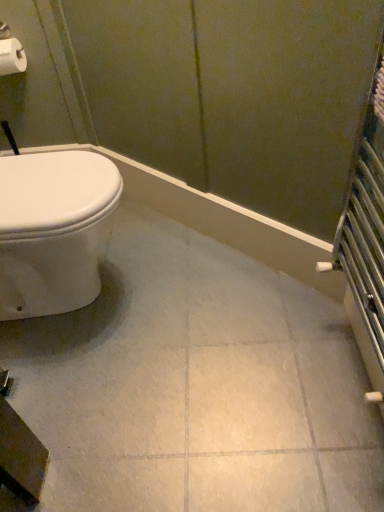
Question: Is white glossy ceramic tile at center shorter than white matte toilet paper at upper left?

Choices:
 (A) yes
 (B) no

Answer: (A)

Question: Can you confirm if white glossy ceramic tile at center is smaller than white matte toilet paper at upper left?

Choices:
 (A) no
 (B) yes

Answer: (A)

Question: From the image's perspective, would you say white glossy ceramic tile at center is positioned over white matte toilet paper at upper left?

Choices:
 (A) yes
 (B) no

Answer: (B)

Question: Is white glossy ceramic tile at center looking in the opposite direction of white matte toilet paper at upper left?

Choices:
 (A) yes
 (B) no

Answer: (B)

Question: Is white glossy ceramic tile at center at the right side of white matte toilet paper at upper left?

Choices:
 (A) yes
 (B) no

Answer: (A)

Question: Is white glossy ceramic tile at center to the left of white matte toilet paper at upper left from the viewer's perspective?

Choices:
 (A) no
 (B) yes

Answer: (A)

Question: Considering the relative sizes of white matte toilet paper at upper left and white glossy ceramic tile at center in the image provided, is white matte toilet paper at upper left thinner than white glossy ceramic tile at center?

Choices:
 (A) yes
 (B) no

Answer: (A)

Question: Is white glossy ceramic tile at center at the back of white matte toilet paper at upper left?

Choices:
 (A) yes
 (B) no

Answer: (B)

Question: Is white matte toilet paper at upper left located outside white glossy ceramic tile at center?

Choices:
 (A) no
 (B) yes

Answer: (B)

Question: Are white matte toilet paper at upper left and white glossy ceramic tile at center located far from each other?

Choices:
 (A) no
 (B) yes

Answer: (B)

Question: Does white matte toilet paper at upper left have a larger size compared to white glossy ceramic tile at center?

Choices:
 (A) yes
 (B) no

Answer: (B)

Question: Is white glossy ceramic tile at center completely or partially inside white matte toilet paper at upper left?

Choices:
 (A) no
 (B) yes

Answer: (A)

Question: Would you say white matte toilet paper at upper left is to the left or to the right of white glossy ceramic tile at center in the picture?

Choices:
 (A) left
 (B) right

Answer: (A)